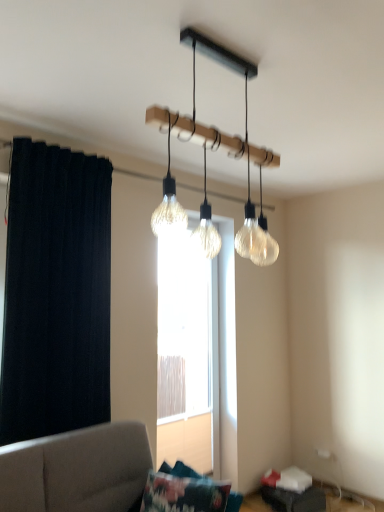
Question: Considering the relative sizes of clear glass light fixture at upper center and translucent glass window at center in the image provided, is clear glass light fixture at upper center thinner than translucent glass window at center?

Choices:
 (A) no
 (B) yes

Answer: (A)

Question: From the image's perspective, is clear glass light fixture at upper center above translucent glass window at center?

Choices:
 (A) yes
 (B) no

Answer: (A)

Question: Is clear glass light fixture at upper center to the left of translucent glass window at center from the viewer's perspective?

Choices:
 (A) yes
 (B) no

Answer: (B)

Question: Is clear glass light fixture at upper center positioned in front of translucent glass window at center?

Choices:
 (A) no
 (B) yes

Answer: (B)

Question: Is clear glass light fixture at upper center facing towards translucent glass window at center?

Choices:
 (A) yes
 (B) no

Answer: (B)

Question: Is translucent glass window at center in front of or behind dark fabric curtain at left in the image?

Choices:
 (A) front
 (B) behind

Answer: (B)

Question: Is translucent glass window at center inside the boundaries of dark fabric curtain at left, or outside?

Choices:
 (A) inside
 (B) outside

Answer: (B)

Question: Is point (162, 260) positioned closer to the camera than point (74, 286)?

Choices:
 (A) farther
 (B) closer

Answer: (A)

Question: Based on their positions, is translucent glass window at center located to the left or right of dark fabric curtain at left?

Choices:
 (A) right
 (B) left

Answer: (A)

Question: Is fluffy fabric pillow at lower center in front of or behind dark fabric curtain at left in the image?

Choices:
 (A) behind
 (B) front

Answer: (B)

Question: Considering the positions of fluffy fabric pillow at lower center and dark fabric curtain at left in the image, is fluffy fabric pillow at lower center wider or thinner than dark fabric curtain at left?

Choices:
 (A) thin
 (B) wide

Answer: (B)

Question: Based on their sizes in the image, would you say fluffy fabric pillow at lower center is bigger or smaller than dark fabric curtain at left?

Choices:
 (A) small
 (B) big

Answer: (A)

Question: From a real-world perspective, is fluffy fabric pillow at lower center positioned above or below dark fabric curtain at left?

Choices:
 (A) above
 (B) below

Answer: (B)

Question: Visually, is translucent glass window at center positioned to the left or to the right of clear glass light fixture at upper center?

Choices:
 (A) right
 (B) left

Answer: (B)

Question: From the image's perspective, is translucent glass window at center positioned above or below clear glass light fixture at upper center?

Choices:
 (A) below
 (B) above

Answer: (A)